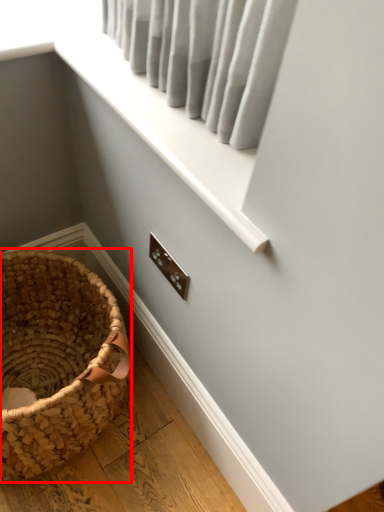
Question: From the image's perspective, where is picnic basket (annotated by the red box) located in relation to window frame in the image?

Choices:
 (A) below
 (B) above

Answer: (A)